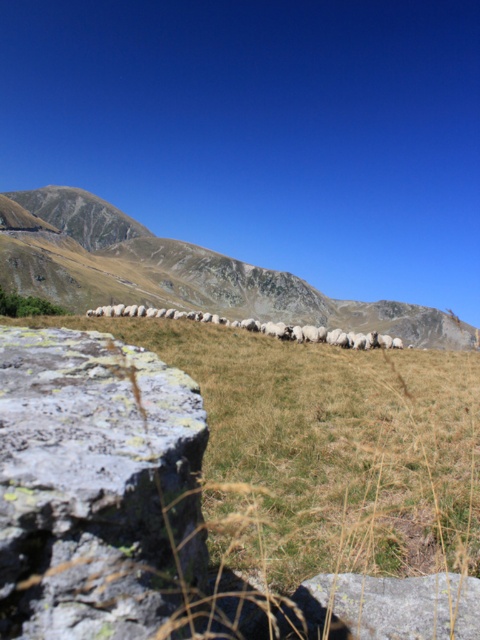
Question: Which object appears closest to the camera in this image?

Choices:
 (A) white woolly sheep at center
 (B) gray rough rock at lower right
 (C) gray rough rock at lower left

Answer: (C)

Question: Which point is farther to the camera?

Choices:
 (A) (336, 616)
 (B) (29, 486)
 (C) (375, 332)
 (D) (127, 221)

Answer: (D)

Question: Does gray rough rock at lower left come in front of brown rocky mountain at center?

Choices:
 (A) no
 (B) yes

Answer: (B)

Question: Can you confirm if brown rocky mountain at center is wider than white woolly sheep at center?

Choices:
 (A) yes
 (B) no

Answer: (A)

Question: Does gray rough rock at lower right have a lesser width compared to white woolly sheep at center?

Choices:
 (A) no
 (B) yes

Answer: (B)

Question: Based on their relative distances, which object is farther from the white woolly sheep at center?

Choices:
 (A) gray rough rock at lower right
 (B) brown rocky mountain at center

Answer: (B)